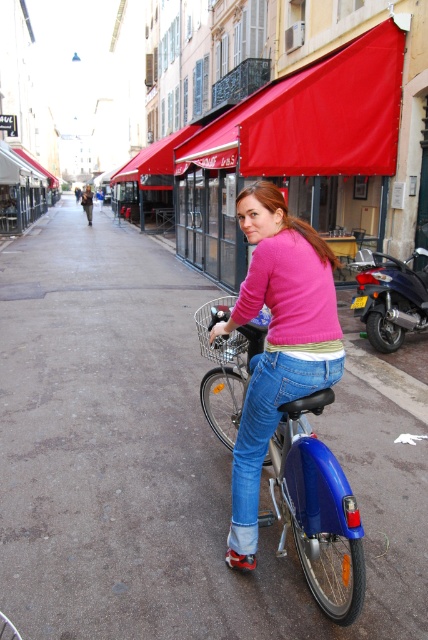
Question: Can you confirm if blue metallic bicycle at center is positioned to the right of jeans at center?

Choices:
 (A) yes
 (B) no

Answer: (A)

Question: Does blue metallic bicycle at center come behind jeans at center?

Choices:
 (A) no
 (B) yes

Answer: (A)

Question: Is blue metallic bicycle at center to the left of jeans at center from the viewer's perspective?

Choices:
 (A) yes
 (B) no

Answer: (B)

Question: Among these objects, which one is farthest from the camera?

Choices:
 (A) jeans at center
 (B) blue metallic bicycle at center

Answer: (A)